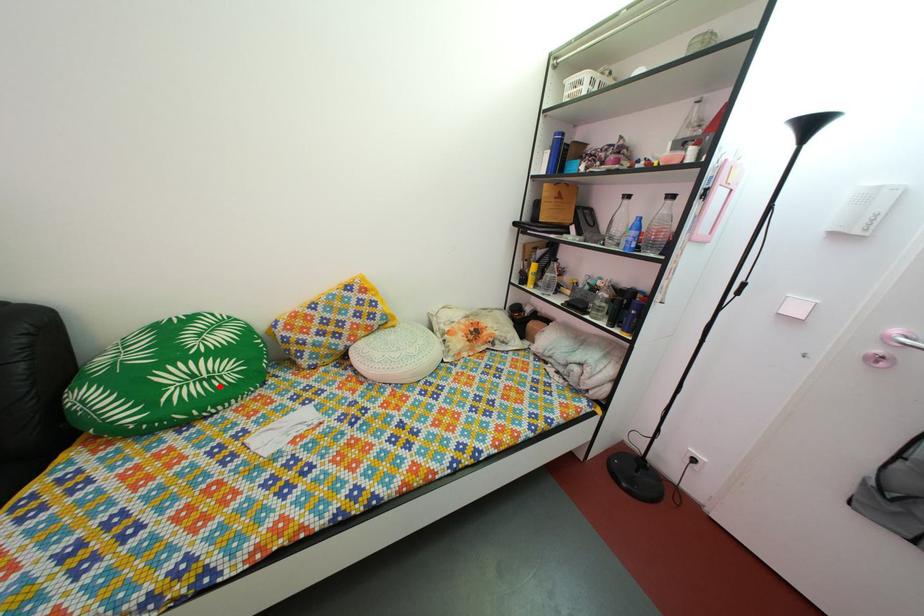
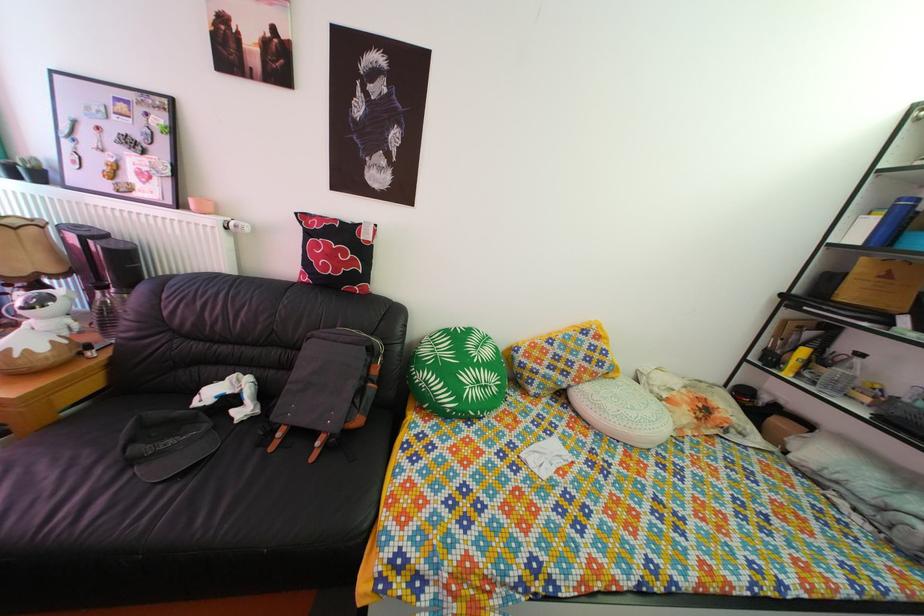
Question: I am providing you with two images of the same scene from different viewpoints. In image1, a red point is highlighted. Considering the same 3D point in image2, which of the following is correct?

Choices:
 (A) It is closer
 (B) It is farther

Answer: (B)